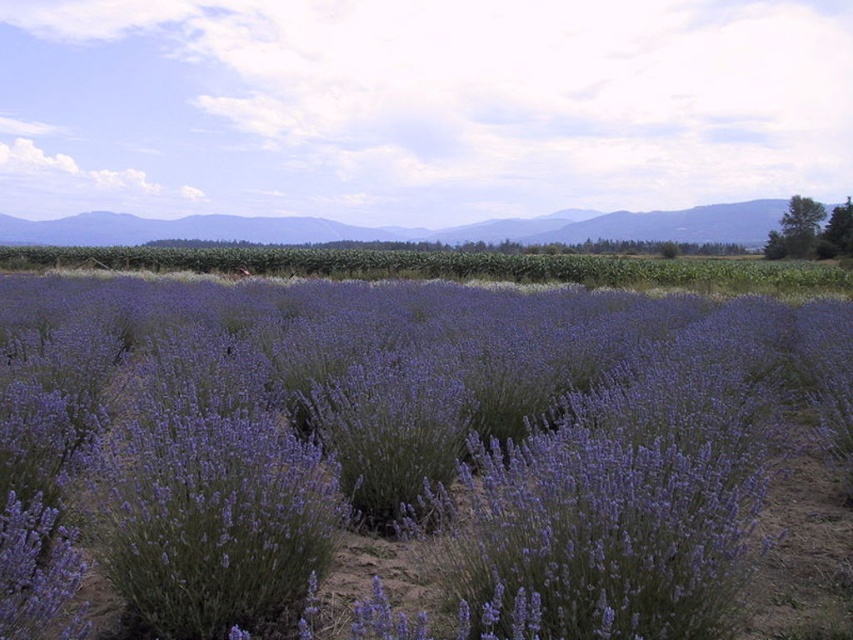
Is purple soft lavender at center smaller than smooth green mountains at upper center?

Yes.

The image size is (853, 640). What do you see at coordinates (410, 436) in the screenshot?
I see `purple soft lavender at center` at bounding box center [410, 436].

Does point (252, 576) come farther from viewer compared to point (57, 244)?

No, it is in front of (57, 244).

The width and height of the screenshot is (853, 640). I want to click on purple soft lavender at center, so click(410, 436).